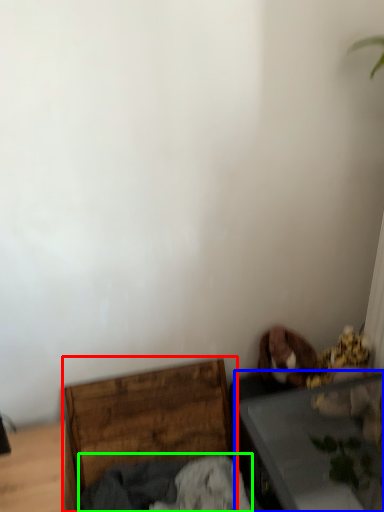
Question: Estimate the real-world distances between objects in this image. Which object is farther from furniture (highlighted by a red box), table (highlighted by a blue box) or clothing (highlighted by a green box)?

Choices:
 (A) table
 (B) clothing

Answer: (A)